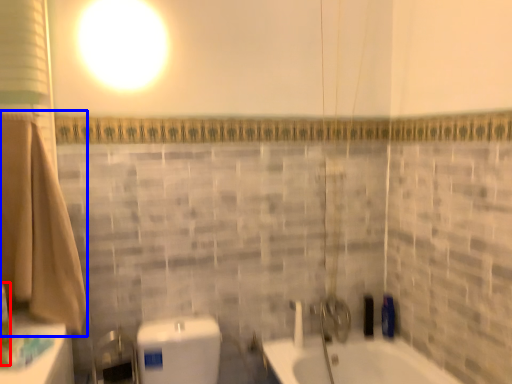
Question: Which object appears closest to the camera in this image, toiletry (highlighted by a red box) or bath towel (highlighted by a blue box)?

Choices:
 (A) toiletry
 (B) bath towel

Answer: (A)